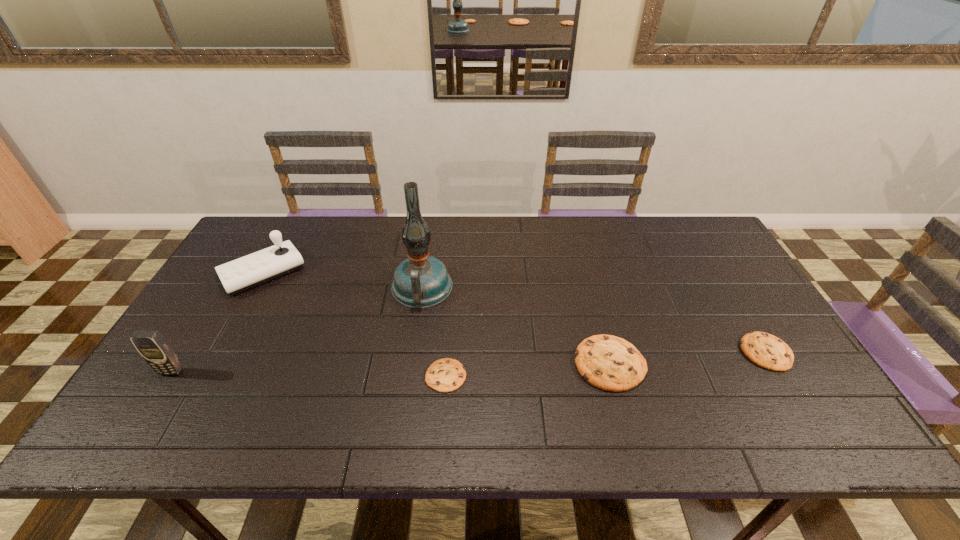
Find the location of a particular element. object present at the near left corner is located at coordinates (157, 352).

In the image, there is a desktop. Where is `vacant space at the far edge`? vacant space at the far edge is located at coordinates coord(432,224).

Locate an element on the screen. The width and height of the screenshot is (960, 540). vacant region at the near edge of the desktop is located at coordinates (486, 405).

In order to click on vacant space at the left edge of the desktop in this screenshot , I will do (229, 339).

Identify the location of free space at the right edge of the desktop. The width and height of the screenshot is (960, 540). (681, 264).

Identify the location of free space at the far right corner of the desktop. The width and height of the screenshot is (960, 540). (690, 254).

In the image, there is a desktop. Where is `blank space at the near right corner`? The image size is (960, 540). blank space at the near right corner is located at coordinates point(790,402).

Locate an element on the screen. The width and height of the screenshot is (960, 540). empty space that is in between the oil lamp and the shortest cookie is located at coordinates (434, 332).

Find the location of a particular element. The width and height of the screenshot is (960, 540). vacant space in between the tallest cookie and the leftmost cookie is located at coordinates (528, 370).

Identify the location of vacant area between the rightmost object and the cellular telephone. (468, 362).